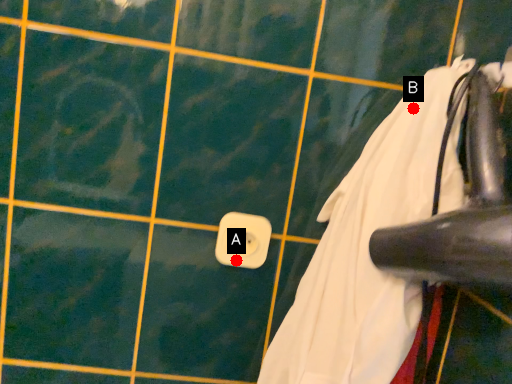
Question: Two points are circled on the image, labeled by A and B beside each circle. Which point is farther to the camera?

Choices:
 (A) A is further
 (B) B is further

Answer: (A)